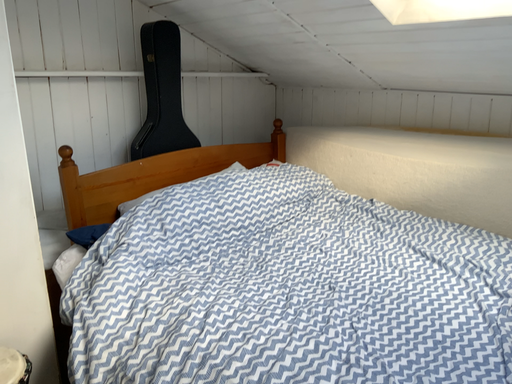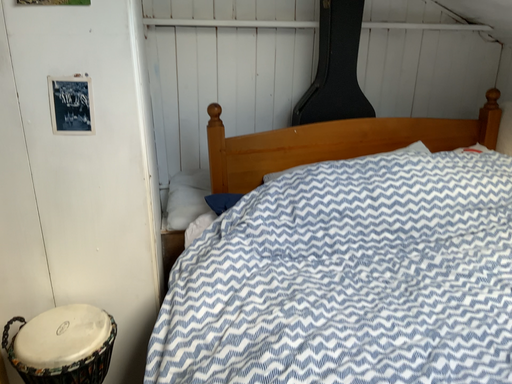
Question: How did the camera likely rotate when shooting the video?

Choices:
 (A) rotated left
 (B) rotated right

Answer: (A)